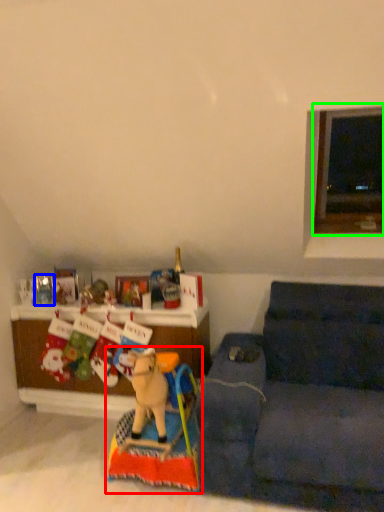
Question: Which object is the farthest from toy (highlighted by a red box)? Choose among these: toy (highlighted by a blue box) or window (highlighted by a green box).

Choices:
 (A) toy
 (B) window

Answer: (B)